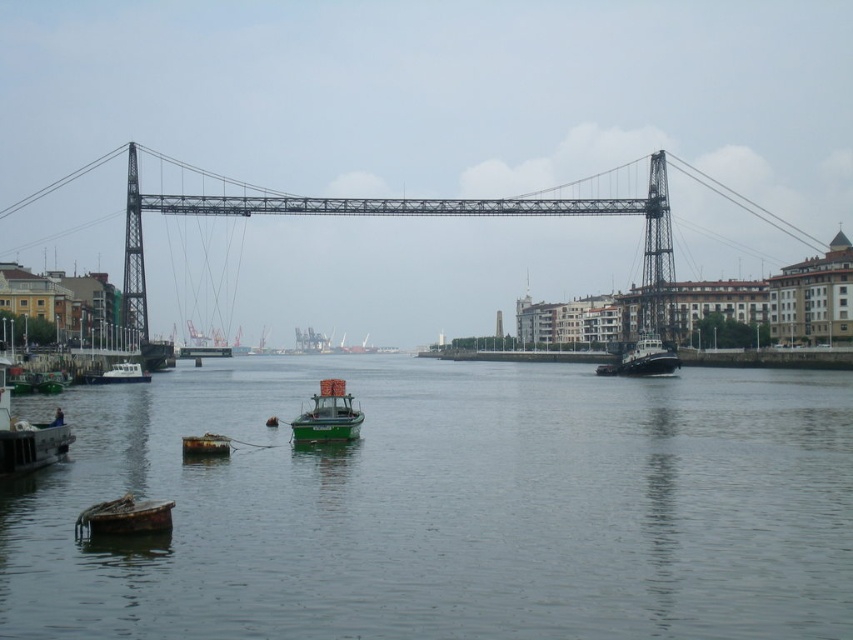
Does metallic bridge at center lie in front of white matte boat at lower left?

No, metallic bridge at center is further to the viewer.

Is metallic bridge at center to the right of white matte boat at lower left from the viewer's perspective?

Indeed, metallic bridge at center is positioned on the right side of white matte boat at lower left.

Which is behind, point (132, 257) or point (120, 364)?

Point (132, 257)

Identify the location of metallic bridge at center. (416, 216).

Can you confirm if rusty wooden boat at lower left is positioned to the left of white matte boat at lower left?

Incorrect, rusty wooden boat at lower left is not on the left side of white matte boat at lower left.

Which is behind, point (143, 509) or point (100, 381)?

The point (100, 381) is more distant.

Is point (112, 506) positioned behind point (102, 374)?

No, (112, 506) is closer to viewer.

Locate an element on the screen. rusty wooden boat at lower left is located at coordinates (123, 516).

Is rusty wooden boat at lower left to the right of green matte tugboat at right from the viewer's perspective?

Incorrect, rusty wooden boat at lower left is not on the right side of green matte tugboat at right.

Is point (74, 524) in front of point (660, 339)?

That is True.

Describe the element at coordinates (123, 516) in the screenshot. This screenshot has width=853, height=640. I see `rusty wooden boat at lower left` at that location.

The image size is (853, 640). Identify the location of rusty wooden boat at lower left. (123, 516).